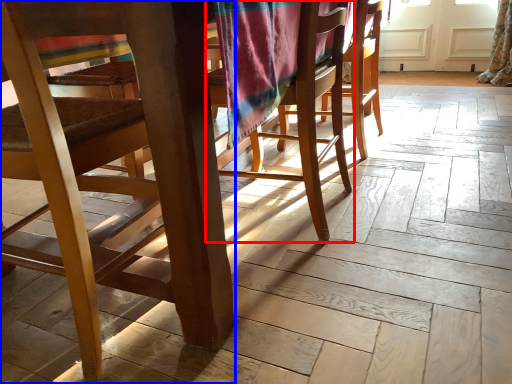
Question: Which object is further to the camera taking this photo, chair (highlighted by a red box) or chair (highlighted by a blue box)?

Choices:
 (A) chair
 (B) chair

Answer: (A)